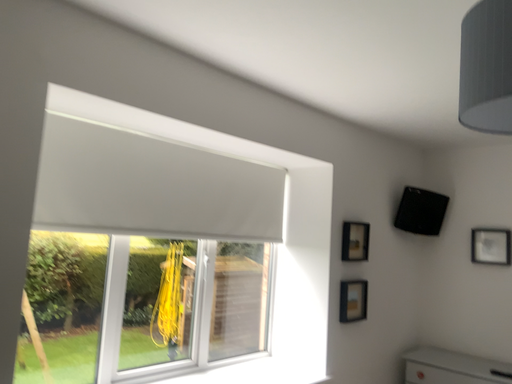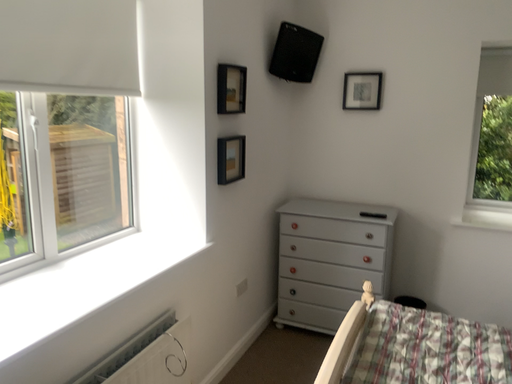
Question: How did the camera likely rotate when shooting the video?

Choices:
 (A) rotated downward
 (B) rotated upward

Answer: (A)